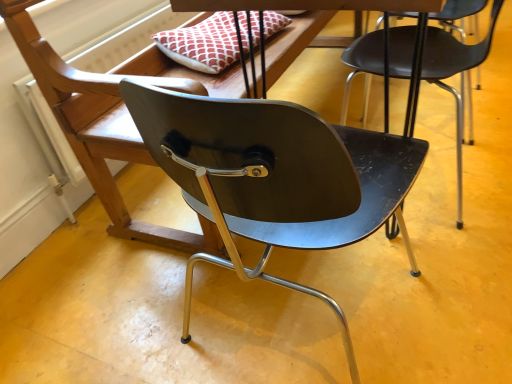
The width and height of the screenshot is (512, 384). Identify the location of vacant space positioned to the left of matte black chair at center, which is the second chair in right-to-left order. (132, 304).